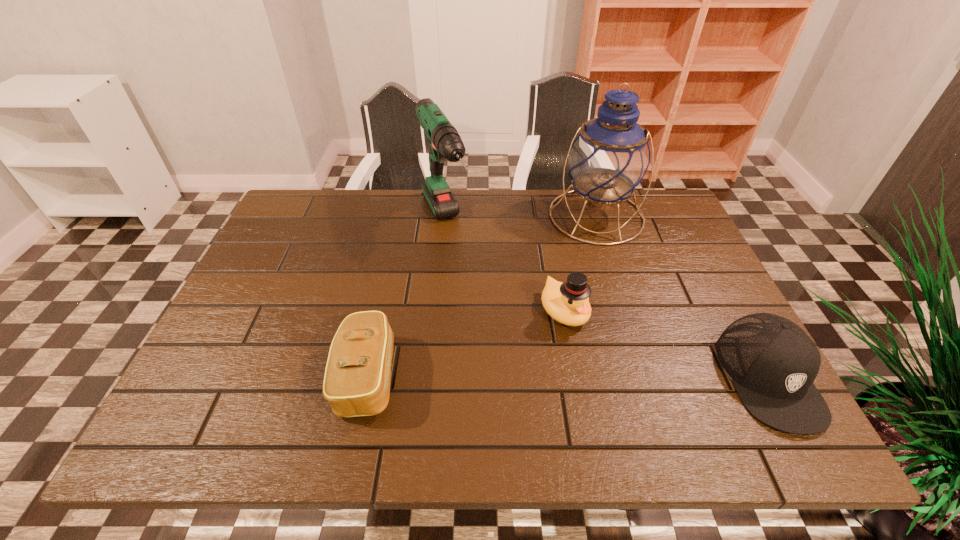
Identify the location of free space on the desktop that is between the clutch bag and the rightmost object and is positioned on the front-facing side of the duck. The height and width of the screenshot is (540, 960). (620, 377).

The image size is (960, 540). In order to click on free space on the desktop that is between the clutch bag and the rightmost object and is positioned on the handle side of the second tallest object in this screenshot , I will do `click(526, 376)`.

Locate an element on the screen. This screenshot has width=960, height=540. vacant space on the desktop that is between the clutch bag and the cap and is positioned on the front-facing side of the lantern is located at coordinates (593, 377).